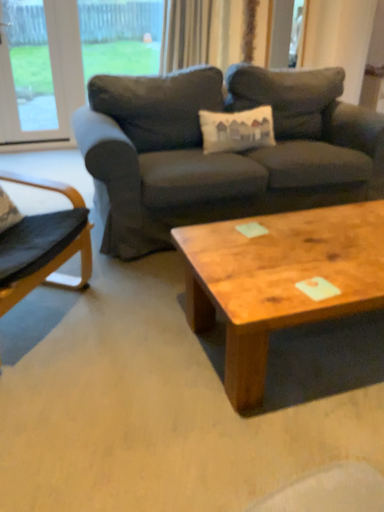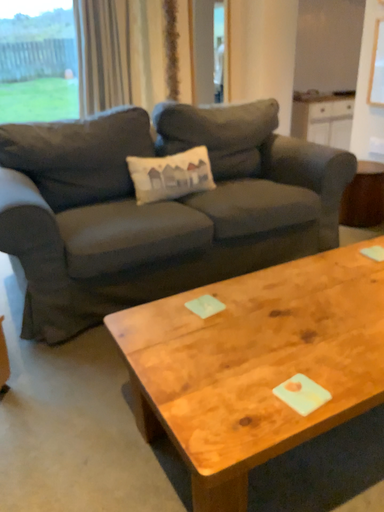
Question: Which way did the camera rotate in the video?

Choices:
 (A) rotated left
 (B) rotated right

Answer: (B)